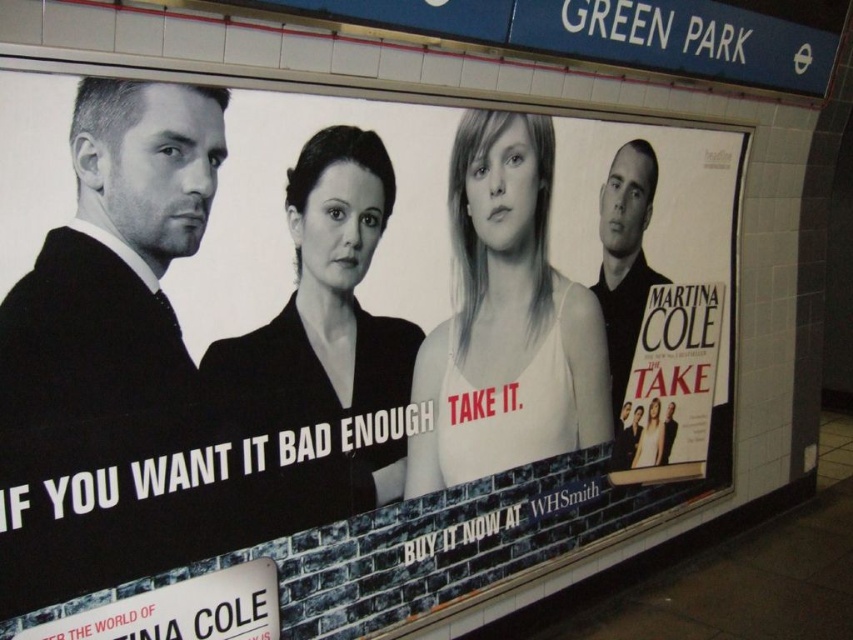
You are standing in the subway station and want to touch the point at coordinates point [474,432] on the advertisement. If your arm can reach 2 meters, can you reach it?

The point [474,432] and viewer are 2.61 meters apart. Since your arm can only reach 2 meters, you cannot reach the point [474,432].

You are a photographer trying to capture a closeup of the book title on the advertisement. You have two points marked on your viewfinder at coordinates point (358,410) and point (635,464). Which point should you focus on to ensure the book title is in sharp focus?

Point (358,410) is closer to the camera than point (635,464), so focusing on point (358,410) will ensure the book title is in sharp focus.